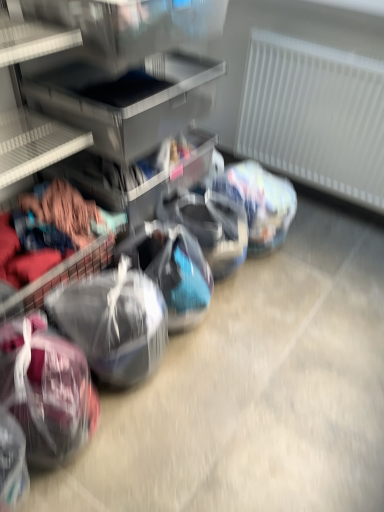
Question: Considering the relative positions of white textured radiator at right and translucent plastic sack at lower left, which is counted as the 2th sack, starting from the left, in the image provided, is white textured radiator at right to the left of translucent plastic sack at lower left, which is counted as the 2th sack, starting from the left, from the viewer's perspective?

Choices:
 (A) yes
 (B) no

Answer: (B)

Question: From the image's perspective, is white textured radiator at right located beneath translucent plastic sack at lower left, the 1th sack positioned from the right?

Choices:
 (A) yes
 (B) no

Answer: (B)

Question: Is white textured radiator at right located outside translucent plastic sack at lower left, which is counted as the 2th sack, starting from the left?

Choices:
 (A) no
 (B) yes

Answer: (B)

Question: Considering the relative sizes of white textured radiator at right and translucent plastic sack at lower left, the 1th sack positioned from the right, in the image provided, is white textured radiator at right thinner than translucent plastic sack at lower left, the 1th sack positioned from the right,?

Choices:
 (A) no
 (B) yes

Answer: (B)

Question: Considering the relative positions of white textured radiator at right and translucent plastic sack at lower left, the 1th sack positioned from the right, in the image provided, is white textured radiator at right in front of translucent plastic sack at lower left, the 1th sack positioned from the right,?

Choices:
 (A) no
 (B) yes

Answer: (A)

Question: Is maroon fabric sack at lower left, which appears as the first sack when viewed from the left, inside or outside of white textured radiator at right?

Choices:
 (A) outside
 (B) inside

Answer: (A)

Question: From the image's perspective, relative to white textured radiator at right, is maroon fabric sack at lower left, the second sack when ordered from right to left, above or below?

Choices:
 (A) below
 (B) above

Answer: (A)

Question: From a real-world perspective, is maroon fabric sack at lower left, the second sack when ordered from right to left, positioned above or below white textured radiator at right?

Choices:
 (A) above
 (B) below

Answer: (B)

Question: Is point (36, 320) positioned closer to the camera than point (296, 99)?

Choices:
 (A) closer
 (B) farther

Answer: (A)

Question: Is white textured radiator at right wider or thinner than translucent plastic sack at lower left, the 1th sack positioned from the right?

Choices:
 (A) wide
 (B) thin

Answer: (B)

Question: Is point (259, 120) closer or farther from the camera than point (87, 304)?

Choices:
 (A) farther
 (B) closer

Answer: (A)

Question: Is white textured radiator at right taller or shorter than translucent plastic sack at lower left, which is counted as the 2th sack, starting from the left?

Choices:
 (A) tall
 (B) short

Answer: (A)

Question: Is white textured radiator at right bigger or smaller than translucent plastic sack at lower left, which is counted as the 2th sack, starting from the left?

Choices:
 (A) big
 (B) small

Answer: (A)

Question: From their relative heights in the image, would you say translucent plastic sack at lower left, which is counted as the 2th sack, starting from the left, is taller or shorter than white textured radiator at right?

Choices:
 (A) short
 (B) tall

Answer: (A)

Question: Considering the positions of translucent plastic sack at lower left, the 1th sack positioned from the right, and white textured radiator at right in the image, is translucent plastic sack at lower left, the 1th sack positioned from the right, wider or thinner than white textured radiator at right?

Choices:
 (A) thin
 (B) wide

Answer: (B)